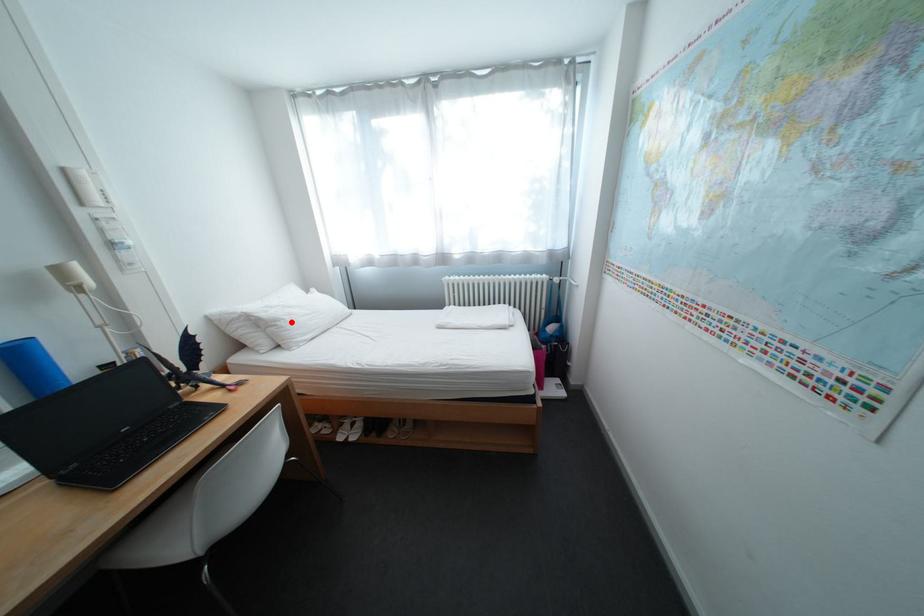
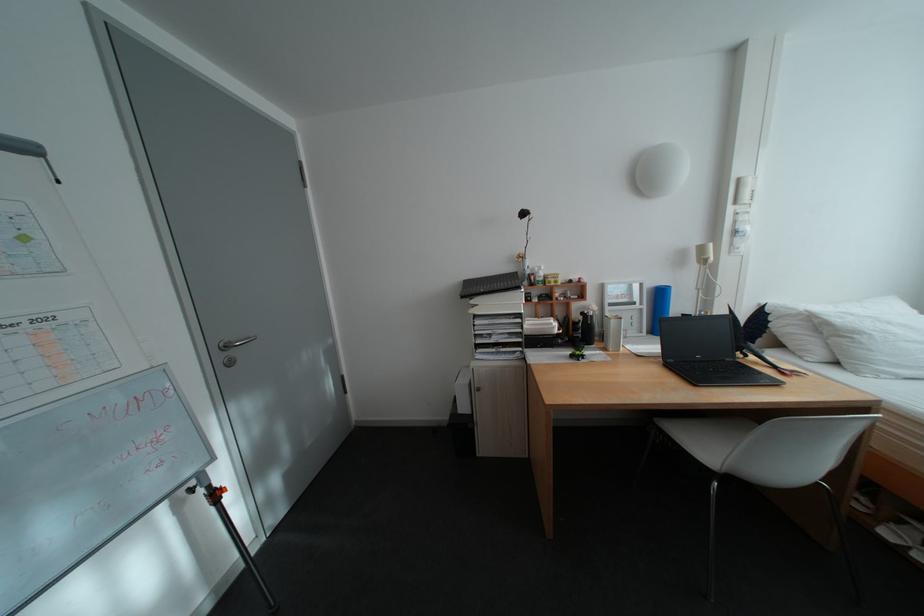
Find the pixel in the second image that matches the highlighted location in the first image.

(871, 334)